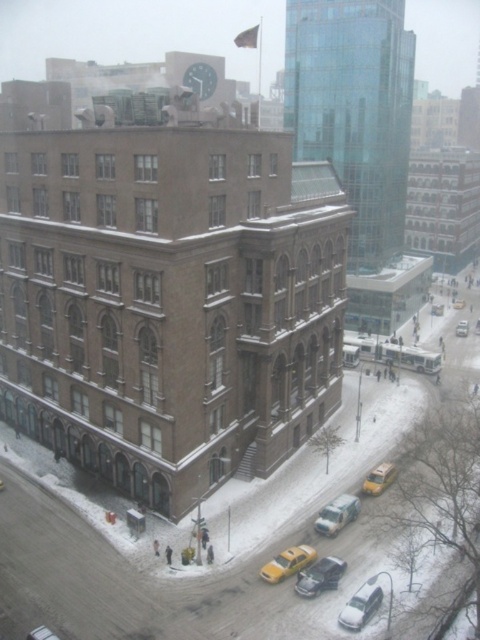
This screenshot has width=480, height=640. What do you see at coordinates (288, 563) in the screenshot?
I see `yellow matte taxi at lower center` at bounding box center [288, 563].

Who is lower down, yellow matte taxi at lower center or yellow matte taxi at lower right?

Positioned lower is yellow matte taxi at lower center.

Between point (303, 564) and point (373, 483), which one is positioned in front?

Point (303, 564)

Find the location of a particular element. Image resolution: width=480 pixels, height=640 pixels. yellow matte taxi at lower center is located at coordinates (288, 563).

Based on the photo, is metallic silver car at center positioned in front of metallic silver car at lower left?

No, metallic silver car at center is further to the viewer.

Can you confirm if metallic silver car at center is bigger than metallic silver car at lower left?

Indeed, metallic silver car at center has a larger size compared to metallic silver car at lower left.

Is point (337, 568) positioned in front of point (34, 632)?

No, (337, 568) is further to viewer.

You are a GUI agent. You are given a task and a screenshot of the screen. Output one action in this format:
    pyautogui.click(x=<x>, y=<y>)
    Task: Click on the metallic silver car at center
    The width and height of the screenshot is (480, 640).
    Given the screenshot: What is the action you would take?
    pyautogui.click(x=320, y=577)

Does white glossy car at lower right appear under yellow matte taxi cab at center?

Indeed, white glossy car at lower right is positioned under yellow matte taxi cab at center.

Is point (370, 618) behind point (459, 324)?

No, (370, 618) is closer to viewer.

Does point (350, 621) lie behind point (468, 330)?

No, (350, 621) is closer to viewer.

The width and height of the screenshot is (480, 640). In order to click on white glossy car at lower right in this screenshot , I will do `click(360, 605)`.